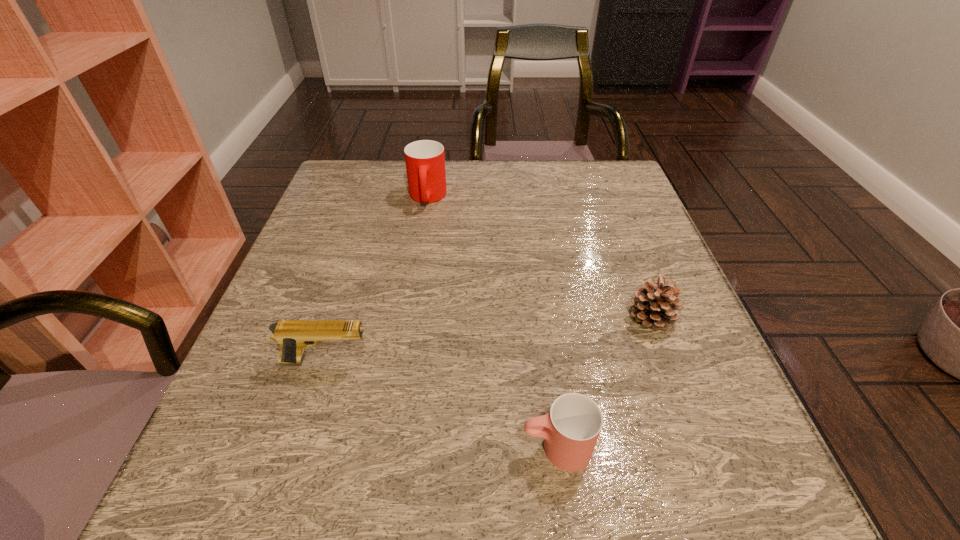
Find the location of a particular element. The width and height of the screenshot is (960, 540). blank region between the taller cup and the third farthest object is located at coordinates (376, 279).

This screenshot has width=960, height=540. I want to click on free space between the farther cup and the shorter cup, so click(x=492, y=322).

Where is `free point between the pistol and the nearer cup`? Image resolution: width=960 pixels, height=540 pixels. free point between the pistol and the nearer cup is located at coordinates (442, 404).

Identify the location of vacant space that is in between the tallest object and the third farthest object. (376, 279).

At what (x,y) coordinates should I click in order to perform the action: click on the second closest object to the right cup. Please return your answer as a coordinate pair (x, y). Image resolution: width=960 pixels, height=540 pixels. Looking at the image, I should click on (293, 336).

In order to click on object that is the third closest to the rightmost object in this screenshot , I will do `click(425, 160)`.

The image size is (960, 540). I want to click on vacant space that satisfies the following two spatial constraints: 1. on the side of the right cup with the handle; 2. on the side of the tallest object with the handle, so click(x=524, y=198).

Find the location of a particular element. vacant space that satisfies the following two spatial constraints: 1. on the side of the rightmost object with the handle; 2. on the left side of the taller cup is located at coordinates (409, 317).

I want to click on vacant space that satisfies the following two spatial constraints: 1. on the side of the farthest object with the handle; 2. on the side of the third object from left to right with the handle, so click(388, 448).

Where is `free space that satisfies the following two spatial constraints: 1. on the side of the shorter cup with the handle; 2. at the barrel of the third farthest object`? free space that satisfies the following two spatial constraints: 1. on the side of the shorter cup with the handle; 2. at the barrel of the third farthest object is located at coordinates (545, 361).